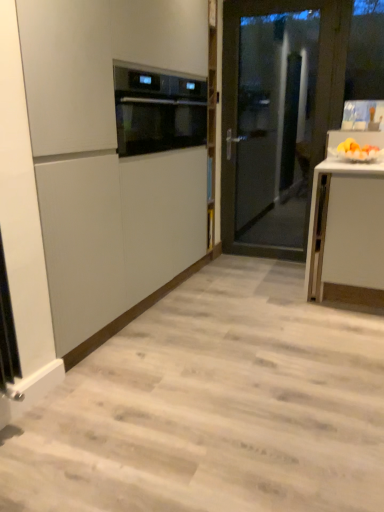
Question: Would you consider satin black oven at upper center to be distant from matte white cabinet at center?

Choices:
 (A) no
 (B) yes

Answer: (A)

Question: From the image's perspective, would you say satin black oven at upper center is shown under matte white cabinet at center?

Choices:
 (A) yes
 (B) no

Answer: (B)

Question: Is satin black oven at upper center outside matte white cabinet at center?

Choices:
 (A) yes
 (B) no

Answer: (B)

Question: Can you confirm if satin black oven at upper center is shorter than matte white cabinet at center?

Choices:
 (A) yes
 (B) no

Answer: (A)

Question: Is satin black oven at upper center looking in the opposite direction of matte white cabinet at center?

Choices:
 (A) no
 (B) yes

Answer: (B)

Question: Is satin black oven at upper center to the right of matte white cabinet at center from the viewer's perspective?

Choices:
 (A) no
 (B) yes

Answer: (B)

Question: Is yellow matte fruit at right bigger than satin black oven at upper center?

Choices:
 (A) no
 (B) yes

Answer: (A)

Question: Is yellow matte fruit at right smaller than satin black oven at upper center?

Choices:
 (A) yes
 (B) no

Answer: (A)

Question: From the image's perspective, does yellow matte fruit at right appear lower than satin black oven at upper center?

Choices:
 (A) no
 (B) yes

Answer: (B)

Question: From the image's perspective, is yellow matte fruit at right over satin black oven at upper center?

Choices:
 (A) yes
 (B) no

Answer: (B)

Question: Would you say yellow matte fruit at right is a long distance from satin black oven at upper center?

Choices:
 (A) no
 (B) yes

Answer: (B)

Question: Can you confirm if yellow matte fruit at right is positioned to the left of satin black oven at upper center?

Choices:
 (A) yes
 (B) no

Answer: (B)

Question: Does satin black oven at upper center have a lesser height compared to yellow matte fruit at right?

Choices:
 (A) no
 (B) yes

Answer: (A)